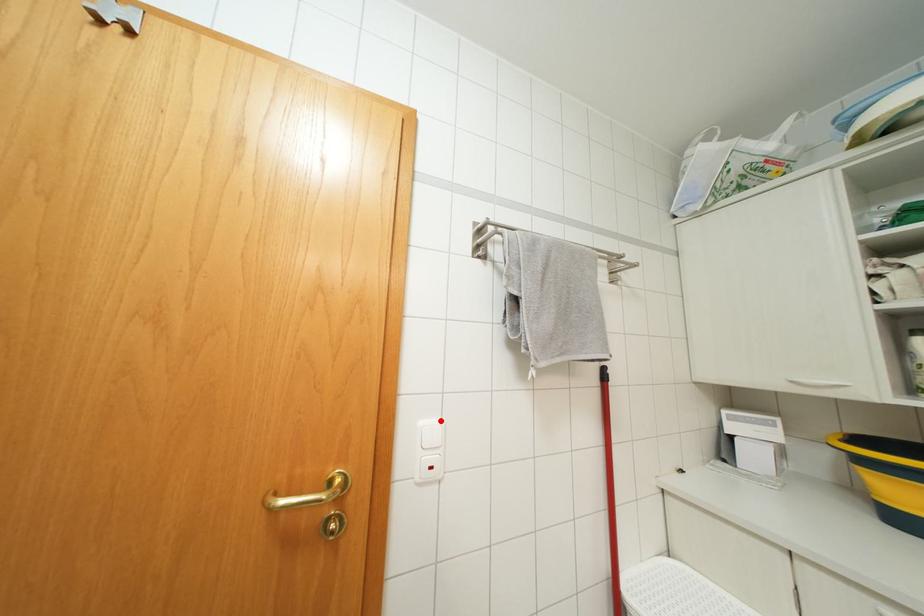
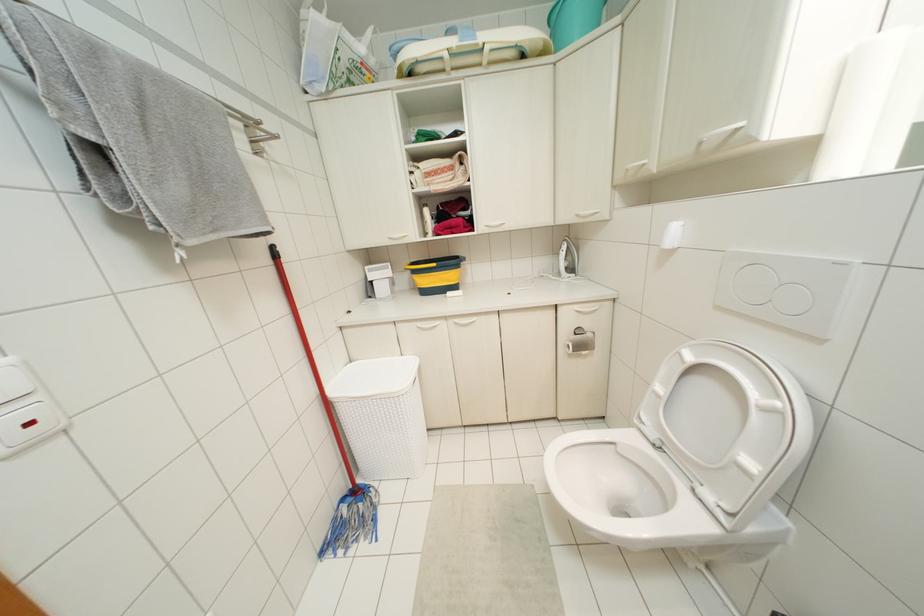
The point at the highlighted location is marked in the first image. Where is the corresponding point in the second image?

(7, 360)